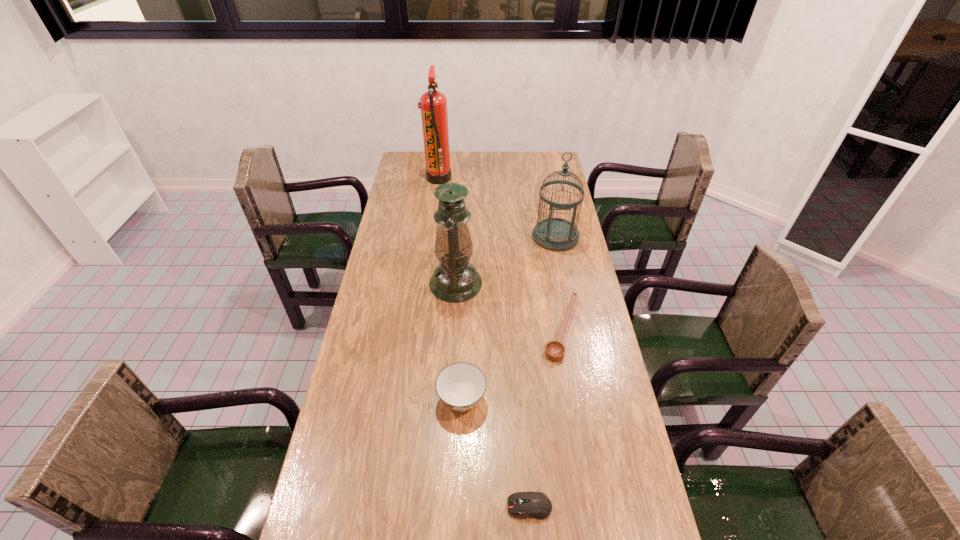
In order to click on free space located 0.330m on the front-facing side of the fifth nearest object in this screenshot , I will do `click(571, 316)`.

The width and height of the screenshot is (960, 540). Identify the location of vacant space located 0.100m on the front of the second nearest object. click(460, 458).

Locate an element on the screen. The width and height of the screenshot is (960, 540). vacant area located on the front of the wooden spoon is located at coordinates point(582,449).

Where is `vacant space located on the button of the computer equipment`? This screenshot has width=960, height=540. vacant space located on the button of the computer equipment is located at coordinates (419, 507).

In order to click on vacant space located on the button of the computer equipment in this screenshot , I will do [339, 507].

The image size is (960, 540). Find the location of `vacant space located on the button of the computer equipment`. vacant space located on the button of the computer equipment is located at coordinates (339, 507).

Where is `object positioned at the far edge`? Image resolution: width=960 pixels, height=540 pixels. object positioned at the far edge is located at coordinates (433, 104).

Where is `object present at the left edge`? This screenshot has height=540, width=960. object present at the left edge is located at coordinates (433, 104).

Where is `birdcage at the right edge`? The height and width of the screenshot is (540, 960). birdcage at the right edge is located at coordinates click(554, 234).

The image size is (960, 540). In order to click on wooden spoon that is positioned at the right edge in this screenshot , I will do `click(555, 350)`.